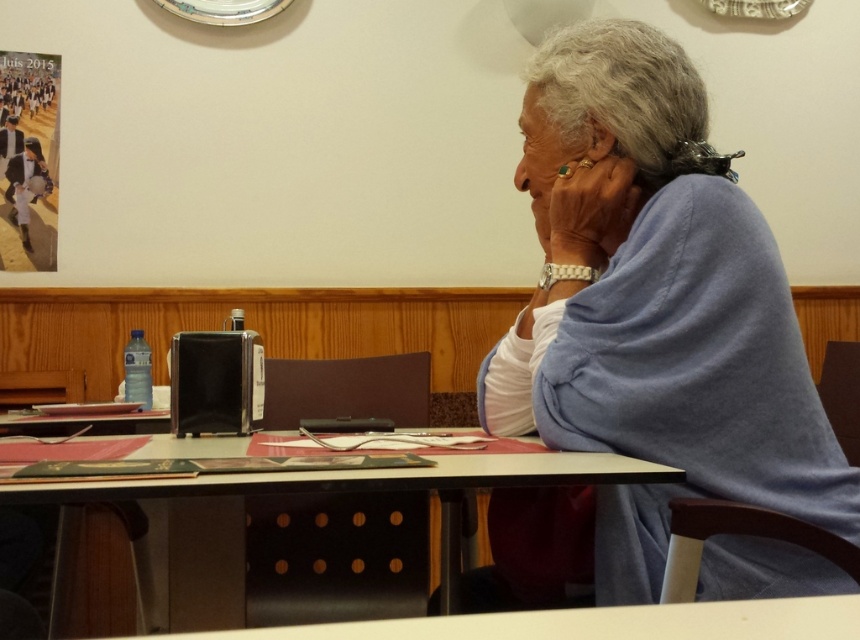
You are standing in the dining room and need to place a small decoration exactly at the coordinates given for the blue fabric at upper right. What is the exact coordinate point where you should place it?

The exact coordinate point for the blue fabric at upper right is [654,307].

You are standing in the dining room and want to place a tall vase on the table. The vase is taller than the blue fabric at upper right. Will it fit on the black plastic table at center?

The blue fabric at upper right is much taller than the black plastic table at center. Since the vase is taller than the blue fabric, it will be even taller than the table, so placing it there may not be stable or practical.

You are a guest at a formal dinner and need to place your napkin. You see a blue fabric at upper right and a black plastic table at center. Where should you place your napkin?

The blue fabric at upper right is located above the black plastic table at center, so you should place your napkin on the black plastic table at center.